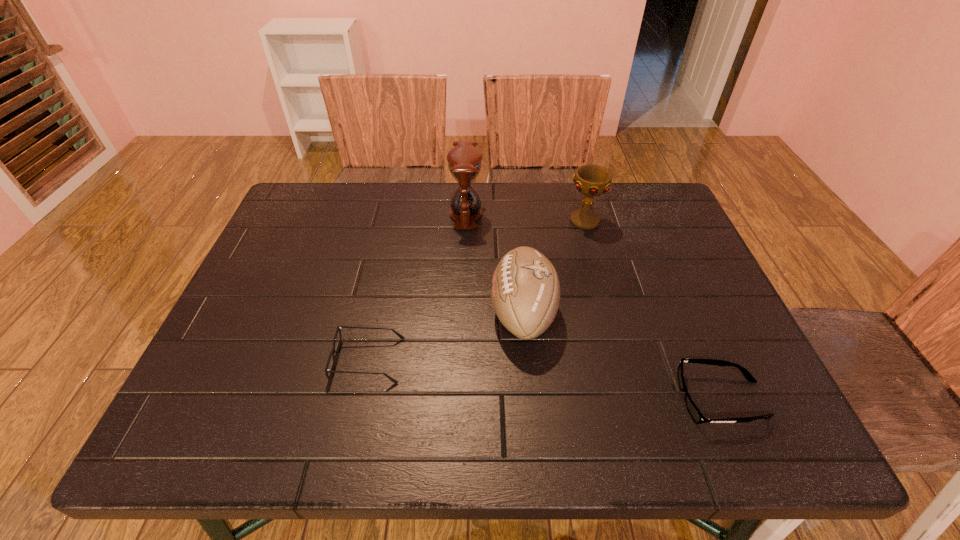
At what (x,y) coordinates should I click in order to perform the action: click on free spot between the spectacles and the second object from right to left. Please return your answer as a coordinate pair (x, y). Looking at the image, I should click on [x=476, y=291].

Locate an element on the screen. The image size is (960, 540). free space between the second object from left to right and the leftmost object is located at coordinates (418, 287).

Identify the location of free space between the third object from right to left and the spectacles. (445, 336).

Where is `object that is the fourth closest one to the fourth object from left to right`? This screenshot has height=540, width=960. object that is the fourth closest one to the fourth object from left to right is located at coordinates (332, 353).

Point out which object is positioned as the nearest to the rightmost object. Please provide its 2D coordinates. Your answer should be formatted as a tuple, i.e. [(x, y)], where the tuple contains the x and y coordinates of a point satisfying the conditions above.

[(525, 290)]

The image size is (960, 540). Identify the location of vacant space that satisfies the following two spatial constraints: 1. on the front side of the chalice; 2. on the left side of the fourth object from right to left. tap(466, 221).

At what (x,y) coordinates should I click in order to perform the action: click on vacant space that satisfies the following two spatial constraints: 1. on the front side of the second object from left to right; 2. on the left side of the fourth object from left to right. Please return your answer as a coordinate pair (x, y). Image resolution: width=960 pixels, height=540 pixels. Looking at the image, I should click on (466, 221).